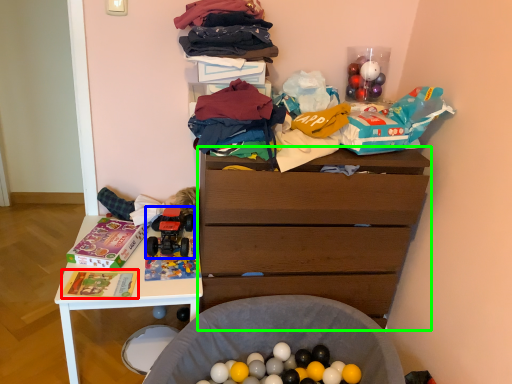
Question: Considering the real-world distances, which object is closest to magazine (highlighted by a red box)? toy (highlighted by a blue box) or chest of drawers (highlighted by a green box).

Choices:
 (A) toy
 (B) chest of drawers

Answer: (A)